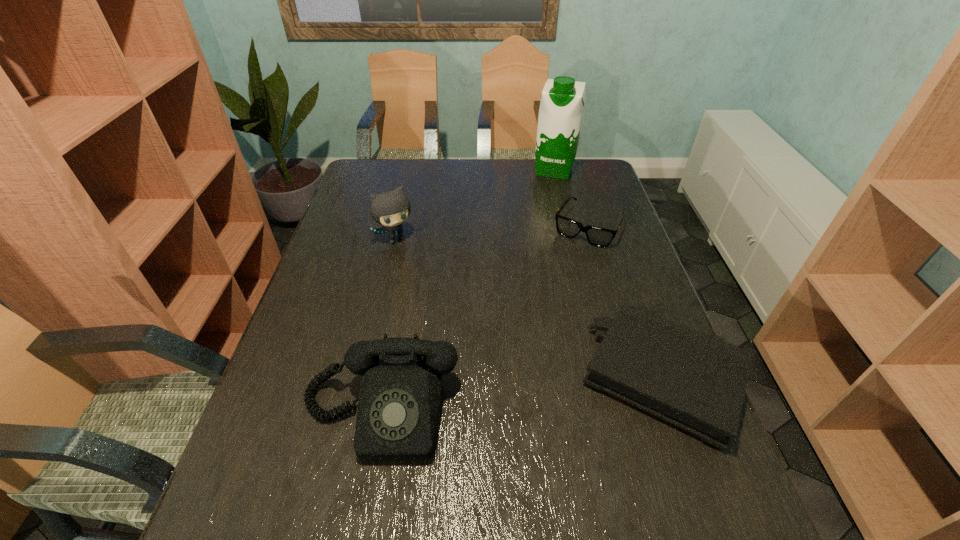
Where is `empty location between the shortest object and the kitten`? The height and width of the screenshot is (540, 960). empty location between the shortest object and the kitten is located at coordinates (492, 233).

Where is `vacant point located between the telephone and the kitten`? vacant point located between the telephone and the kitten is located at coordinates (389, 326).

Select which object appears as the third closest to the soya milk. Please provide its 2D coordinates. Your answer should be formatted as a tuple, i.e. [(x, y)], where the tuple contains the x and y coordinates of a point satisfying the conditions above.

[(697, 382)]

Identify which object is the closest to the sunglasses. Please provide its 2D coordinates. Your answer should be formatted as a tuple, i.e. [(x, y)], where the tuple contains the x and y coordinates of a point satisfying the conditions above.

[(562, 102)]

Identify the location of vacant area that satisfies the following two spatial constraints: 1. on the back side of the farthest object; 2. on the right side of the kitten. (413, 170).